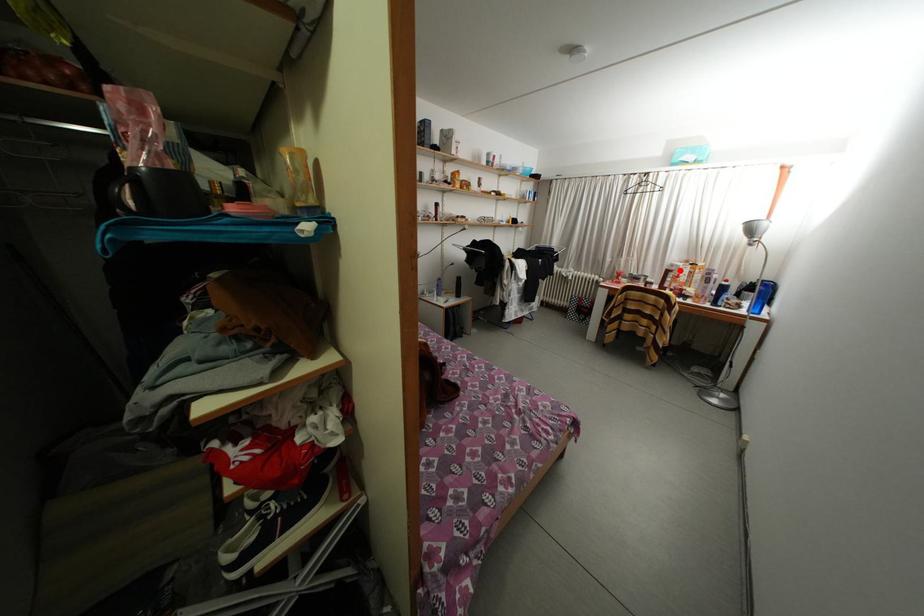
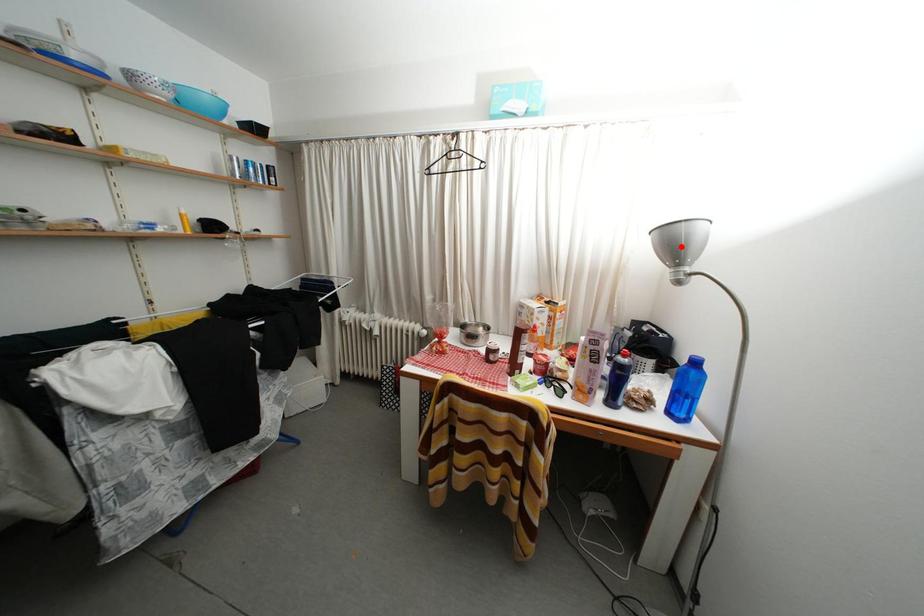
I am providing you with two images of the same scene from different viewpoints. A red point is marked on the first image and another point is marked on the second image. Is the marked point in image1 the same physical position as the marked point in image2?

No